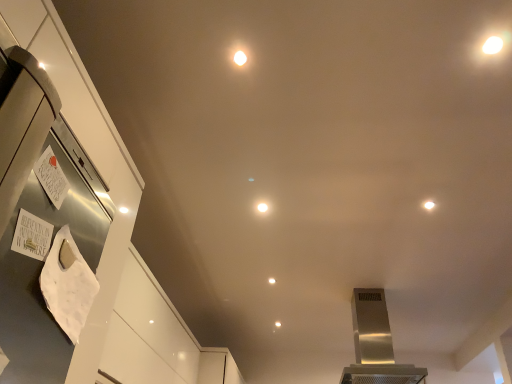
Where is `stainless steel range hood at center`? stainless steel range hood at center is located at coordinates (375, 344).

This screenshot has width=512, height=384. I want to click on stainless steel range hood at center, so click(x=375, y=344).

From the picture: Is white glossy light at upper center, acting as the first light starting from the top, closer to the viewer compared to white glossy light at center, the second light from the right?

Yes, white glossy light at upper center, acting as the first light starting from the top, is closer to the viewer.

There is a white glossy light at upper center, acting as the first light starting from the top. Identify the location of the 1st light below it (from the image's perspective). (262, 207).

In the scene shown: Which is more to the left, white glossy light at upper center, which appears as the 1th light when viewed from the left, or white glossy light at center, which is the 2th light from left to right?

Positioned to the left is white glossy light at upper center, which appears as the 1th light when viewed from the left.

Considering the positions of point (246, 58) and point (270, 278), is point (246, 58) closer or farther from the camera than point (270, 278)?

Point (246, 58).

Considering the sizes of objects white glossy light at upper center, arranged as the 3th light when viewed from the back, and matte white light at center, which appears as the third light when viewed from the front, in the image provided, who is wider, white glossy light at upper center, arranged as the 3th light when viewed from the back, or matte white light at center, which appears as the third light when viewed from the front,?

Wider between the two is matte white light at center, which appears as the third light when viewed from the front.

Would you say white glossy light at upper center, the third light positioned from the bottom, is to the left or to the right of matte white light at center, the 3th light from the left, in the picture?

Based on their positions, white glossy light at upper center, the third light positioned from the bottom, is located to the left of matte white light at center, the 3th light from the left.

Which is correct: white glossy light at upper center, the third light positioned from the bottom, is inside matte white light at center, which appears as the third light when viewed from the front, or outside of it?

white glossy light at upper center, the third light positioned from the bottom, is outside matte white light at center, which appears as the third light when viewed from the front.

Does white glossy light at upper center, which appears as the 1th light when viewed from the left, appear on the right side of stainless steel range hood at center?

Incorrect, white glossy light at upper center, which appears as the 1th light when viewed from the left, is not on the right side of stainless steel range hood at center.

How distant is white glossy light at upper center, arranged as the 1th light when viewed from the front, from stainless steel range hood at center?

A distance of 2.79 meters exists between white glossy light at upper center, arranged as the 1th light when viewed from the front, and stainless steel range hood at center.

From the image's perspective, is white glossy light at upper center, arranged as the 1th light when viewed from the front, above or below stainless steel range hood at center?

white glossy light at upper center, arranged as the 1th light when viewed from the front, is above stainless steel range hood at center.

Is white glossy light at upper center, which ranks as the 3th light in right-to-left order, taller or shorter than stainless steel range hood at center?

Clearly, white glossy light at upper center, which ranks as the 3th light in right-to-left order, is shorter compared to stainless steel range hood at center.

Who is shorter, white glossy light at center, the second light from the right, or stainless steel range hood at center?

Standing shorter between the two is white glossy light at center, the second light from the right.

Would you say white glossy light at center, the 2th light in the front-to-back sequence, is outside stainless steel range hood at center?

Yes, white glossy light at center, the 2th light in the front-to-back sequence, is outside of stainless steel range hood at center.

Are white glossy light at center, placed as the 2th light when sorted from back to front, and stainless steel range hood at center located far from each other?

Indeed, white glossy light at center, placed as the 2th light when sorted from back to front, is not near stainless steel range hood at center.

Considering the sizes of objects white glossy light at center, the 2th light in the front-to-back sequence, and stainless steel range hood at center in the image provided, who is wider, white glossy light at center, the 2th light in the front-to-back sequence, or stainless steel range hood at center?

stainless steel range hood at center.

Considering the sizes of objects stainless steel range hood at center and white glossy light at upper center, acting as the first light starting from the top, in the image provided, who is smaller, stainless steel range hood at center or white glossy light at upper center, acting as the first light starting from the top,?

With smaller size is white glossy light at upper center, acting as the first light starting from the top.

From a real-world perspective, is stainless steel range hood at center below white glossy light at upper center, which ranks as the 3th light in right-to-left order?

Yes, from a real-world perspective, stainless steel range hood at center is below white glossy light at upper center, which ranks as the 3th light in right-to-left order.

Does stainless steel range hood at center have a lesser height compared to white glossy light at upper center, which appears as the 1th light when viewed from the left?

No, stainless steel range hood at center is not shorter than white glossy light at upper center, which appears as the 1th light when viewed from the left.

Is stainless steel range hood at center inside or outside of white glossy light at upper center, arranged as the 1th light when viewed from the front?

stainless steel range hood at center lies outside white glossy light at upper center, arranged as the 1th light when viewed from the front.

What are the coordinates of `the 1st light positioned above the matte white light at center, the 1th light positioned from the back (from a real-world perspective)` in the screenshot? It's located at (262, 207).

Is white glossy light at center, the 2th light in the front-to-back sequence, in contact with matte white light at center, the 1th light positioned from the back?

No.

Is point (260, 205) less distant than point (269, 282)?

Yes, point (260, 205) is in front of point (269, 282).

Is matte white light at center, the 3th light from the left, surrounded by white glossy light at center, positioned as the second light in top-to-bottom order?

No, matte white light at center, the 3th light from the left, is not surrounded by white glossy light at center, positioned as the second light in top-to-bottom order.

Which object is closer to the camera, matte white light at center, the 3th light from the left, or stainless steel range hood at center?

Positioned in front is stainless steel range hood at center.

From the image's perspective, which object appears higher, matte white light at center, which is counted as the first light, starting from the bottom, or stainless steel range hood at center?

From the image's view, matte white light at center, which is counted as the first light, starting from the bottom, is above.

Which is more to the right, matte white light at center, marked as the 3th light in a top-to-bottom arrangement, or stainless steel range hood at center?

stainless steel range hood at center is more to the right.

Can we say matte white light at center, the 3th light from the left, lies outside stainless steel range hood at center?

Absolutely, matte white light at center, the 3th light from the left, is external to stainless steel range hood at center.

Locate an element on the screen. The image size is (512, 384). the 1st light below the white glossy light at upper center, acting as the first light starting from the top (from the image's perspective) is located at coordinates coord(262,207).

From a real-world perspective, starting from the white glossy light at upper center, the third light positioned from the bottom, which light is the 2nd one below it? Please provide its 2D coordinates.

[(272, 281)]

From the image, which object appears to be nearer to white glossy light at upper center, which appears as the 1th light when viewed from the left, matte white light at center, which is counted as the first light, starting from the bottom, or stainless steel range hood at center?

Based on the image, matte white light at center, which is counted as the first light, starting from the bottom, appears to be nearer to white glossy light at upper center, which appears as the 1th light when viewed from the left.

Which object lies further to the anchor point matte white light at center, arranged as the 1th light when viewed from the right, white glossy light at upper center, which appears as the 1th light when viewed from the left, or stainless steel range hood at center?

white glossy light at upper center, which appears as the 1th light when viewed from the left, lies further to matte white light at center, arranged as the 1th light when viewed from the right, than the other object.

Which object lies further to the anchor point matte white light at center, marked as the 3th light in a top-to-bottom arrangement, white glossy light at center, which is counted as the second light, starting from the bottom, or stainless steel range hood at center?

white glossy light at center, which is counted as the second light, starting from the bottom, is positioned further to the anchor matte white light at center, marked as the 3th light in a top-to-bottom arrangement.

Looking at the image, which one is located closer to white glossy light at upper center, which ranks as the 3th light in right-to-left order, stainless steel range hood at center or matte white light at center, the 3th light from the left?

matte white light at center, the 3th light from the left, lies closer to white glossy light at upper center, which ranks as the 3th light in right-to-left order, than the other object.

From the image, which object appears to be farther from stainless steel range hood at center, white glossy light at upper center, arranged as the 1th light when viewed from the front, or white glossy light at center, the 2th light in the front-to-back sequence?

white glossy light at upper center, arranged as the 1th light when viewed from the front, lies further to stainless steel range hood at center than the other object.

Which object lies further to the anchor point stainless steel range hood at center, matte white light at center, the 3th light from the left, or white glossy light at upper center, arranged as the 3th light when viewed from the back?

The object further to stainless steel range hood at center is white glossy light at upper center, arranged as the 3th light when viewed from the back.

Looking at this image, when comparing their distances from white glossy light at upper center, which ranks as the 3th light in right-to-left order, does white glossy light at center, placed as the 2th light when sorted from back to front, or stainless steel range hood at center seem further?

stainless steel range hood at center lies further to white glossy light at upper center, which ranks as the 3th light in right-to-left order, than the other object.

Estimate the real-world distances between objects in this image. Which object is further from stainless steel range hood at center, white glossy light at upper center, acting as the first light starting from the top, or matte white light at center, marked as the 3th light in a top-to-bottom arrangement?

white glossy light at upper center, acting as the first light starting from the top, lies further to stainless steel range hood at center than the other object.

At what (x,y) coordinates should I click in order to perform the action: click on light between white glossy light at upper center, acting as the first light starting from the top, and matte white light at center, which appears as the third light when viewed from the front, in the front-back direction. Please return your answer as a coordinate pair (x, y). Looking at the image, I should click on (262, 207).

Identify the location of light that lies between white glossy light at center, which is counted as the second light, starting from the bottom, and stainless steel range hood at center from top to bottom. Image resolution: width=512 pixels, height=384 pixels. (272, 281).